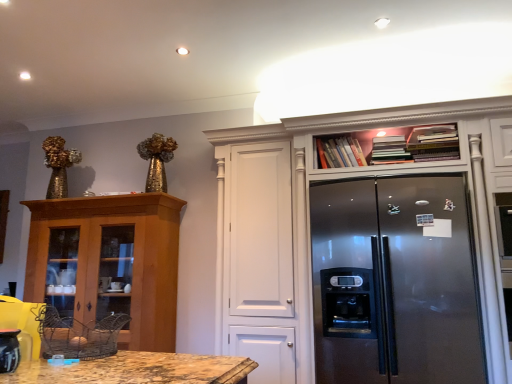
Question: Is matte black coffee pot at lower left placed right next to wooden cabinet at left, positioned as the second cabinetry in right-to-left order?

Choices:
 (A) no
 (B) yes

Answer: (A)

Question: Can you confirm if matte black coffee pot at lower left is thinner than wooden cabinet at left, which ranks as the 1th cabinetry in left-to-right order?

Choices:
 (A) yes
 (B) no

Answer: (A)

Question: Does matte black coffee pot at lower left have a smaller size compared to wooden cabinet at left, which ranks as the 1th cabinetry in left-to-right order?

Choices:
 (A) no
 (B) yes

Answer: (B)

Question: Considering the relative positions of matte black coffee pot at lower left and wooden cabinet at left, positioned as the second cabinetry in right-to-left order, in the image provided, is matte black coffee pot at lower left to the left of wooden cabinet at left, positioned as the second cabinetry in right-to-left order, from the viewer's perspective?

Choices:
 (A) yes
 (B) no

Answer: (B)

Question: Could you tell me if matte black coffee pot at lower left is turned towards wooden cabinet at left, which ranks as the 1th cabinetry in left-to-right order?

Choices:
 (A) no
 (B) yes

Answer: (A)

Question: From the image's perspective, is matte black coffee pot at lower left over wooden cabinet at left, which ranks as the 1th cabinetry in left-to-right order?

Choices:
 (A) no
 (B) yes

Answer: (B)

Question: From the image's perspective, does satin silver refrigerator at center appear higher than satin silver refrigerator at upper right, the second cabinetry in the left-to-right sequence?

Choices:
 (A) yes
 (B) no

Answer: (B)

Question: Is satin silver refrigerator at center located outside satin silver refrigerator at upper right, which appears as the 1th cabinetry when viewed from the right?

Choices:
 (A) no
 (B) yes

Answer: (A)

Question: Is satin silver refrigerator at upper right, the second cabinetry in the left-to-right sequence, completely or partially inside satin silver refrigerator at center?

Choices:
 (A) yes
 (B) no

Answer: (A)

Question: Is satin silver refrigerator at center oriented towards satin silver refrigerator at upper right, the second cabinetry in the left-to-right sequence?

Choices:
 (A) yes
 (B) no

Answer: (A)

Question: Is satin silver refrigerator at center placed right next to satin silver refrigerator at upper right, the second cabinetry in the left-to-right sequence?

Choices:
 (A) yes
 (B) no

Answer: (B)

Question: Is satin silver refrigerator at center at the right side of satin silver refrigerator at upper right, which appears as the 1th cabinetry when viewed from the right?

Choices:
 (A) no
 (B) yes

Answer: (B)

Question: Does satin silver refrigerator at upper right, which appears as the 1th cabinetry when viewed from the right, have a greater height compared to satin silver refrigerator at center?

Choices:
 (A) yes
 (B) no

Answer: (A)